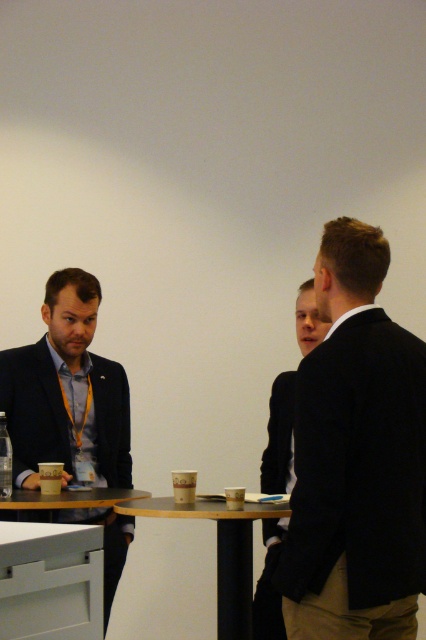
Can you confirm if black matte suit at center is positioned to the right of white glossy table at lower left?

Correct, you'll find black matte suit at center to the right of white glossy table at lower left.

Who is more distant from viewer, (273, 605) or (5, 506)?

Point (273, 605)

Is point (279, 534) positioned in front of point (124, 497)?

No, it is not.

The height and width of the screenshot is (640, 426). Find the location of `black matte suit at center`. black matte suit at center is located at coordinates (279, 436).

Does dark suit jacket at center have a lesser height compared to white glossy table at lower left?

No.

Is dark suit jacket at center thinner than white glossy table at lower left?

Indeed, dark suit jacket at center has a lesser width compared to white glossy table at lower left.

What do you see at coordinates (279, 436) in the screenshot? I see `dark suit jacket at center` at bounding box center [279, 436].

Identify the location of dark suit jacket at center. This screenshot has width=426, height=640. (279, 436).

Does black suit at right appear under matte black suit at left?

Actually, black suit at right is above matte black suit at left.

Is black suit at right to the left of matte black suit at left from the viewer's perspective?

Incorrect, black suit at right is not on the left side of matte black suit at left.

Which is in front, point (328, 298) or point (123, 474)?

Point (328, 298) is in front.

Image resolution: width=426 pixels, height=640 pixels. I want to click on black suit at right, so click(x=356, y=458).